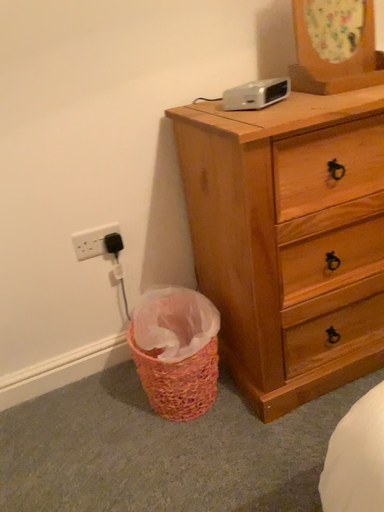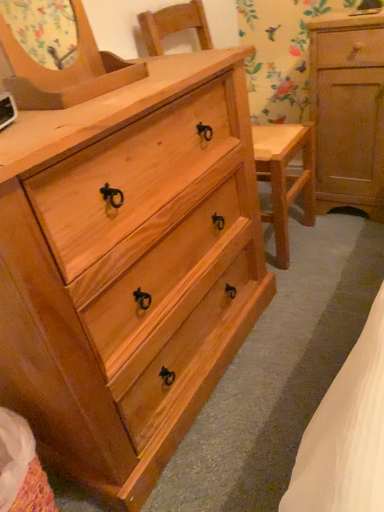
Question: Which way did the camera rotate in the video?

Choices:
 (A) rotated right
 (B) rotated left

Answer: (A)